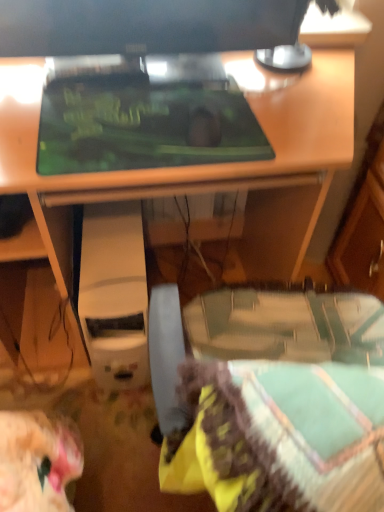
Describe the element at coordinates (145, 26) in the screenshot. The height and width of the screenshot is (512, 384). I see `matte black monitor at upper center` at that location.

In order to face white plastic computer at center, should I rotate leftwards or rightwards?

It's best to rotate left around 10.792 degrees.

What is the approximate height of white plastic computer at center?

white plastic computer at center is 16.40 inches in height.

Identify the location of matte black desk at center. (205, 165).

Measure the distance between green matte mousepad at center and camera.

A distance of 28.98 inches exists between green matte mousepad at center and camera.

The width and height of the screenshot is (384, 512). I want to click on matte black monitor at upper center, so click(x=145, y=26).

Can you confirm if matte black desk at center is shorter than white plastic computer at center?

No, matte black desk at center is not shorter than white plastic computer at center.

Considering the relative sizes of matte black desk at center and white plastic computer at center in the image provided, is matte black desk at center wider than white plastic computer at center?

Yes, matte black desk at center is wider than white plastic computer at center.

How distant is matte black desk at center from white plastic computer at center?

matte black desk at center and white plastic computer at center are 11.77 inches apart from each other.

Is the position of matte black desk at center less distant than that of white plastic computer at center?

That is True.

Is matte black desk at center at the back of green matte mousepad at center?

Correct, green matte mousepad at center is looking away from matte black desk at center.

Is green matte mousepad at center to the right of matte black desk at center from the viewer's perspective?

Correct, you'll find green matte mousepad at center to the right of matte black desk at center.

From the image's perspective, is green matte mousepad at center above or below matte black desk at center?

green matte mousepad at center is above matte black desk at center.

Is matte black monitor at upper center facing towards matte black desk at center?

No, matte black monitor at upper center is not facing towards matte black desk at center.

From the image's perspective, is matte black monitor at upper center under matte black desk at center?

Incorrect, from the image's perspective, matte black monitor at upper center is higher than matte black desk at center.

At what (x,y) coordinates should I click in order to perform the action: click on computer monitor above the matte black desk at center (from the image's perspective). Please return your answer as a coordinate pair (x, y). This screenshot has width=384, height=512. Looking at the image, I should click on [x=145, y=26].

Which object is closer to the camera taking this photo, matte black monitor at upper center or matte black desk at center?

matte black desk at center is more forward.

Is white plastic computer at center positioned before matte black monitor at upper center?

That is False.

Does point (106, 332) lie in front of point (235, 3)?

No, (106, 332) is further to viewer.

From a real-world perspective, is white plastic computer at center located higher than matte black monitor at upper center?

No, from a real-world perspective, white plastic computer at center is not above matte black monitor at upper center.

Between white plastic computer at center and matte black monitor at upper center, which one appears on the left side from the viewer's perspective?

Positioned to the left is white plastic computer at center.

Can you confirm if matte black monitor at upper center is shorter than green matte mousepad at center?

In fact, matte black monitor at upper center may be taller than green matte mousepad at center.

Looking at this image, is matte black monitor at upper center at the left side of green matte mousepad at center?

Yes, matte black monitor at upper center is to the left of green matte mousepad at center.

What's the angular difference between matte black monitor at upper center and green matte mousepad at center's facing directions?

There is a 0.156-degree angle between the facing directions of matte black monitor at upper center and green matte mousepad at center.

How far apart are matte black monitor at upper center and green matte mousepad at center?

They are 7.12 inches apart.

How many degrees apart are the facing directions of matte black desk at center and green matte mousepad at center?

The angle between the facing direction of matte black desk at center and the facing direction of green matte mousepad at center is 2.19e-05 degrees.

Are matte black desk at center and green matte mousepad at center beside each other?

matte black desk at center and green matte mousepad at center are clearly separated.

Is matte black desk at center facing towards green matte mousepad at center?

No, matte black desk at center does not turn towards green matte mousepad at center.

Does green matte mousepad at center touch white plastic computer at center?

No, green matte mousepad at center is not next to white plastic computer at center.

Is green matte mousepad at center surrounding white plastic computer at center?

No, white plastic computer at center is not surrounded by green matte mousepad at center.

Does point (51, 159) appear closer or farther from the camera than point (103, 342)?

Clearly, point (51, 159) is closer to the camera than point (103, 342).

Is green matte mousepad at center wider than white plastic computer at center?

In fact, green matte mousepad at center might be narrower than white plastic computer at center.

Locate an element on the screen. desk lying in front of the white plastic computer at center is located at coordinates 205,165.

The width and height of the screenshot is (384, 512). Identify the location of crt screen located behind the matte black desk at center. (143, 122).

Estimate the real-world distances between objects in this image. Which object is further from matte black desk at center, green matte mousepad at center or white plastic computer at center?

white plastic computer at center is positioned further to the anchor matte black desk at center.

From the image, which object appears to be farther from matte black desk at center, green matte mousepad at center or matte black monitor at upper center?

Among the two, matte black monitor at upper center is located further to matte black desk at center.

Estimate the real-world distances between objects in this image. Which object is closer to white plastic computer at center, matte black desk at center or matte black monitor at upper center?

matte black desk at center lies closer to white plastic computer at center than the other object.

Based on the photo, when comparing their distances from matte black desk at center, does matte black monitor at upper center or green matte mousepad at center seem closer?

green matte mousepad at center is closer to matte black desk at center.

Looking at the image, which one is located closer to green matte mousepad at center, matte black monitor at upper center or matte black desk at center?

Among the two, matte black monitor at upper center is located nearer to green matte mousepad at center.

Consider the image. Looking at the image, which one is located further to matte black desk at center, white plastic computer at center or matte black monitor at upper center?

white plastic computer at center is positioned further to the anchor matte black desk at center.

When comparing their distances from green matte mousepad at center, does white plastic computer at center or matte black monitor at upper center seem closer?

matte black monitor at upper center lies closer to green matte mousepad at center than the other object.

Estimate the real-world distances between objects in this image. Which object is further from green matte mousepad at center, matte black desk at center or white plastic computer at center?

Among the two, white plastic computer at center is located further to green matte mousepad at center.

Find the location of a particular element. This screenshot has width=384, height=512. desk that lies between matte black monitor at upper center and white plastic computer at center from top to bottom is located at coordinates (205, 165).

The image size is (384, 512). In order to click on crt screen between matte black desk at center and white plastic computer at center from front to back in this screenshot , I will do `click(143, 122)`.

What are the coordinates of `crt screen between matte black monitor at upper center and white plastic computer at center in the up-down direction` in the screenshot? It's located at (143, 122).

You are a GUI agent. You are given a task and a screenshot of the screen. Output one action in this format:
    pyautogui.click(x=<x>, y=<y>)
    Task: Click on the crt screen that lies between matte black monitor at upper center and matte black desk at center from top to bottom
    
    Given the screenshot: What is the action you would take?
    pyautogui.click(x=143, y=122)